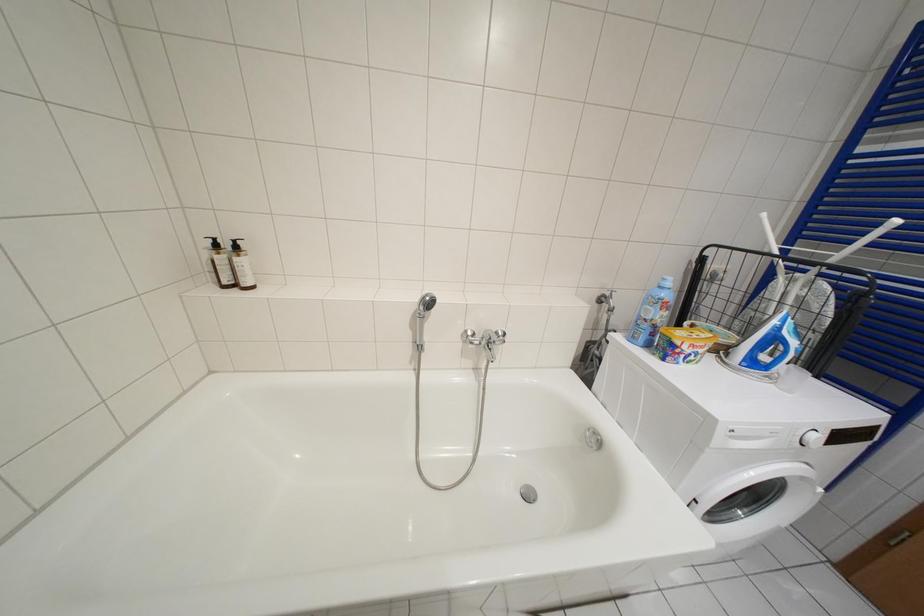
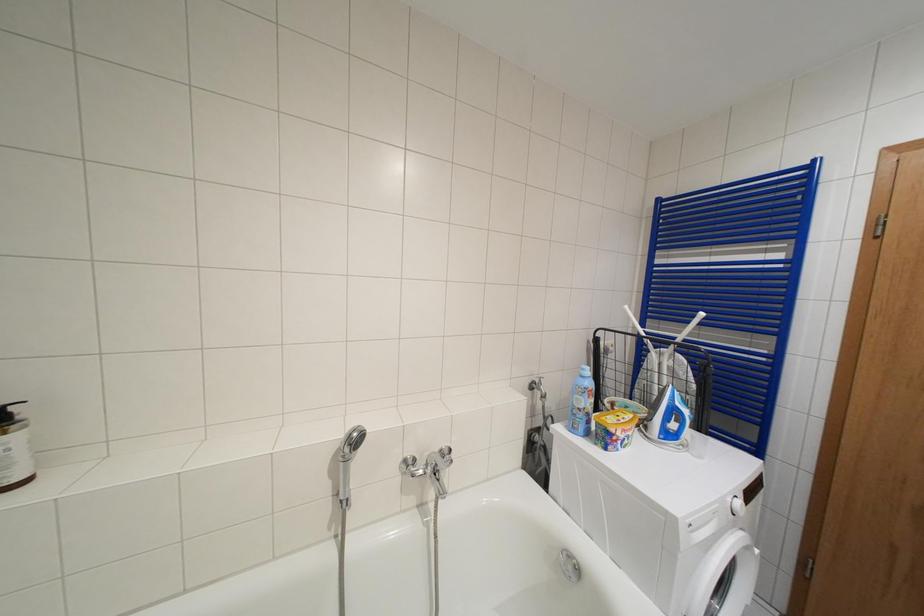
The images are taken continuously from a first-person perspective. In which direction is your viewpoint rotating?

The camera's rotation is toward right-up.